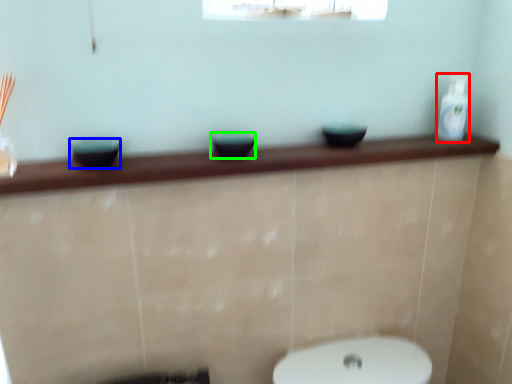
Question: Which object is positioned closest to toiletry (highlighted by a red box)? Select from basin (highlighted by a blue box) and basin (highlighted by a green box).

Choices:
 (A) basin
 (B) basin

Answer: (B)